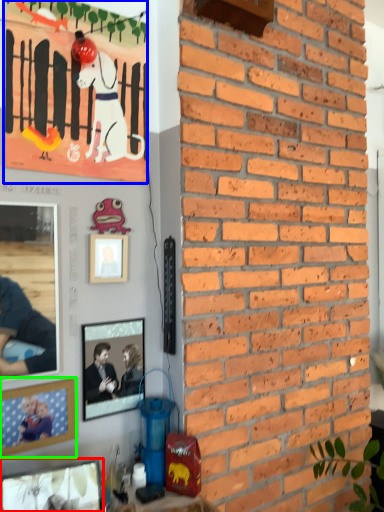
Question: Which is farther away from picture frame (highlighted by a red box)? poster (highlighted by a blue box) or picture frame (highlighted by a green box)?

Choices:
 (A) poster
 (B) picture frame

Answer: (A)